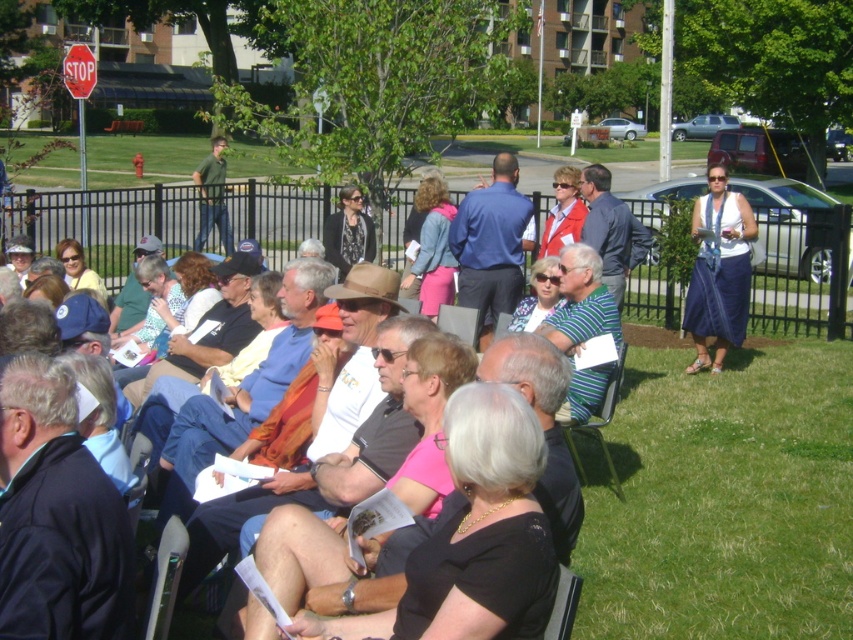
You are attending an outdoor event and see a striped fabric chair at center and a metallic red stop sign at upper left. Which object is positioned to the right of the other?

The striped fabric chair at center is positioned to the right of the metallic red stop sign at upper left.

You are organizing a small outdoor event and need to ensure there is enough space between the striped fabric chair at center and the denim skirt at right for a server to pass through comfortably. Based on the image, can the server easily move between them?

The denim skirt at right is wider than the striped fabric chair at center. Since the server needs space to pass, the wider denim skirt at right may block the path, making it difficult for the server to move comfortably between them.